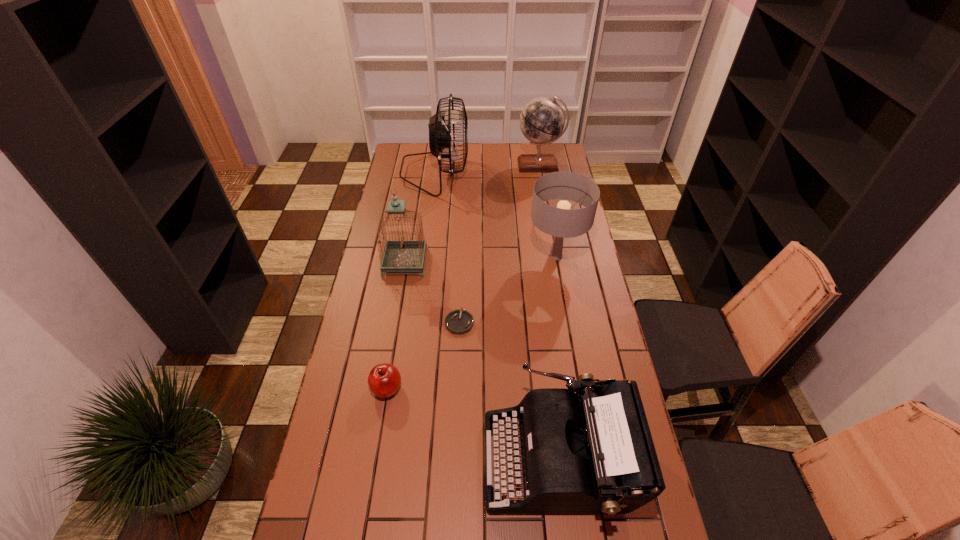
Where is `birdcage that is positioned at the left edge`? birdcage that is positioned at the left edge is located at coordinates (402, 255).

This screenshot has width=960, height=540. What are the coordinates of `apple that is positioned at the left edge` in the screenshot? It's located at (384, 380).

Image resolution: width=960 pixels, height=540 pixels. Identify the location of globe situated at the right edge. (542, 120).

The width and height of the screenshot is (960, 540). Find the location of `lampshade located at the right edge`. lampshade located at the right edge is located at coordinates (561, 222).

Identify the location of typewriter that is positioned at the right edge. (591, 452).

This screenshot has height=540, width=960. Identify the location of object that is at the far left corner. (441, 135).

The image size is (960, 540). Find the location of `object that is at the far right corner`. object that is at the far right corner is located at coordinates (542, 120).

I want to click on vacant area at the far edge of the desktop, so click(x=519, y=148).

This screenshot has width=960, height=540. I want to click on blank space at the left edge of the desktop, so click(x=394, y=183).

What are the coordinates of `free space at the right edge` in the screenshot? It's located at (590, 268).